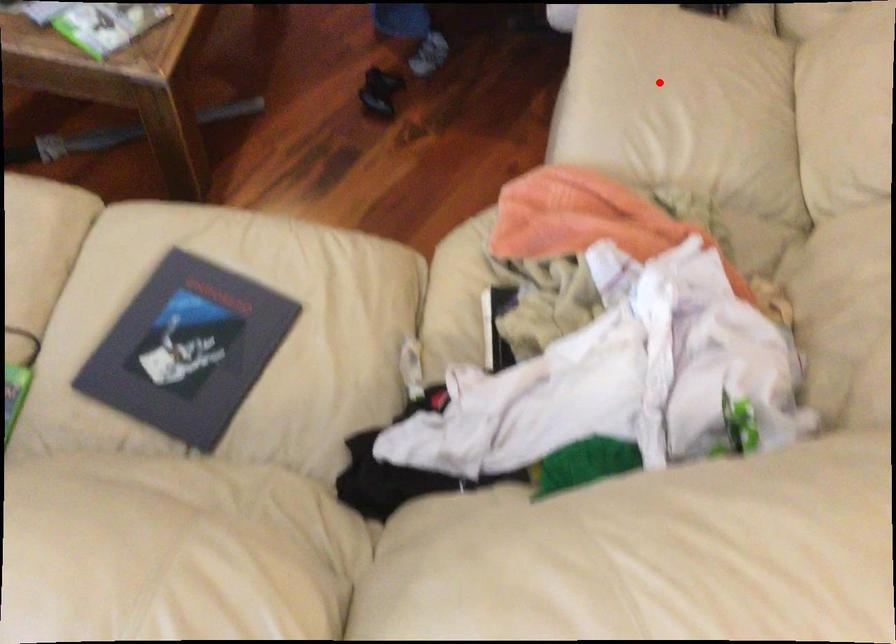
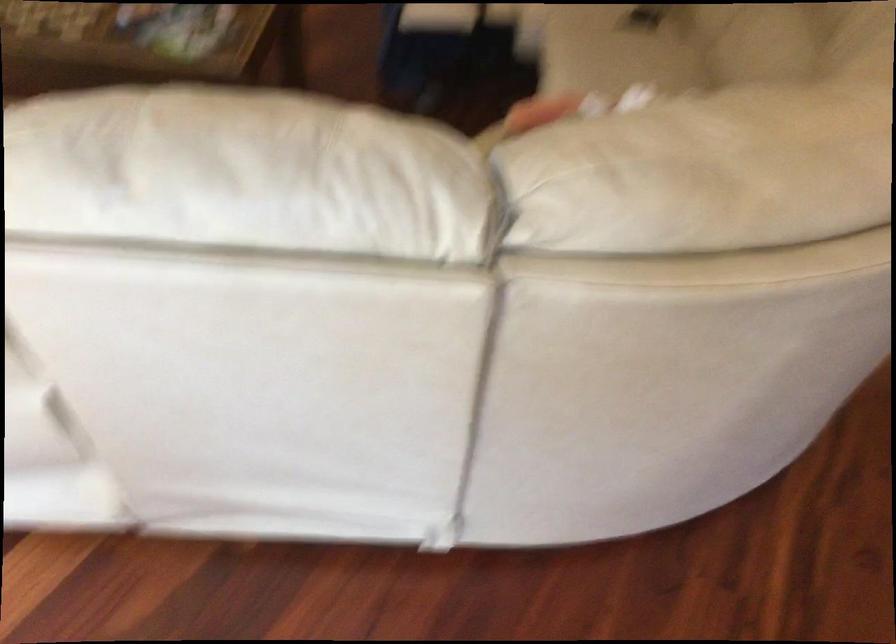
Question: I am providing you with two images of the same scene from different viewpoints. A red point is shown in image1. For the corresponding object point in image2, is it positioned nearer or farther from the camera?

Choices:
 (A) Nearer
 (B) Farther

Answer: (B)